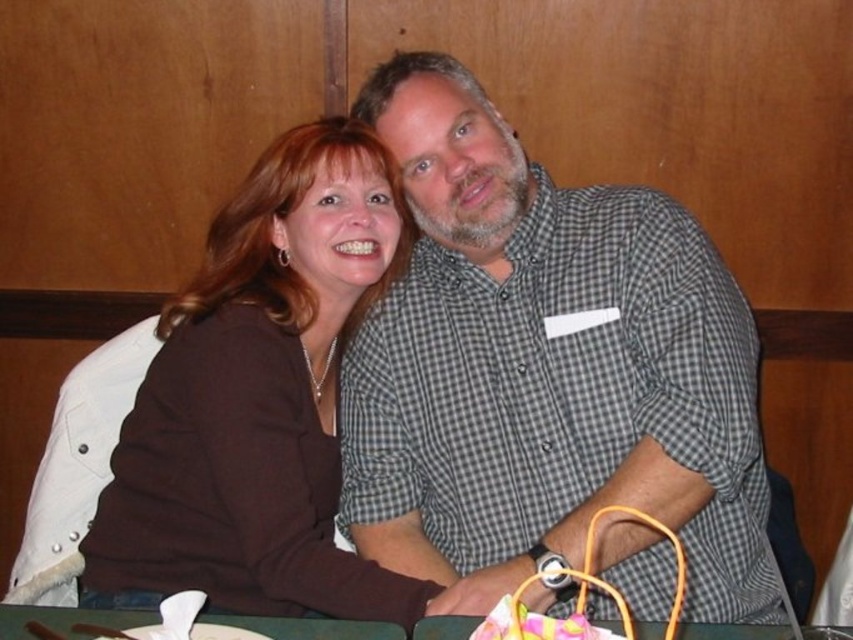
You are a photographer standing at the entrance of the restaurant. You need to take a photo of the gray checkered shirt at center. Where should you position yourself to capture the shirt at point (544, 369)?

The gray checkered shirt at center is located at point (544, 369), so you should position yourself directly facing that coordinate to capture it.

You are a photographer setting up for a group photo. You need to ensure that the gray checkered shirt at center and brown matte sweater at center are both visible in the frame. Which clothing item should you focus on first to ensure proper exposure, considering their sizes?

The gray checkered shirt at center has a larger size compared to brown matte sweater at center, so you should focus on the gray checkered shirt at center first to ensure proper exposure since it takes up more space in the frame.

You are a photographer trying to capture a candid shot of the two people at the table. You notice a specific point marked at coordinates [544,369]. Which person should you focus on to ensure the gray checkered shirt at center is in the frame?

The point at coordinates [544,369] corresponds to the gray checkered shirt at center, so focusing on that point will ensure the gray checkered shirt at center is in the frame.